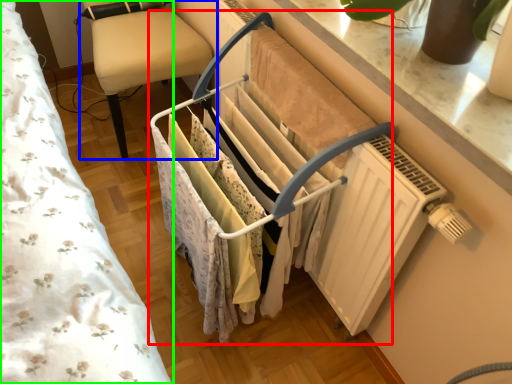
Question: Estimate the real-world distances between objects in this image. Which object is closer to closet (highlighted by a red box), furniture (highlighted by a blue box) or bed (highlighted by a green box)?

Choices:
 (A) furniture
 (B) bed

Answer: (B)